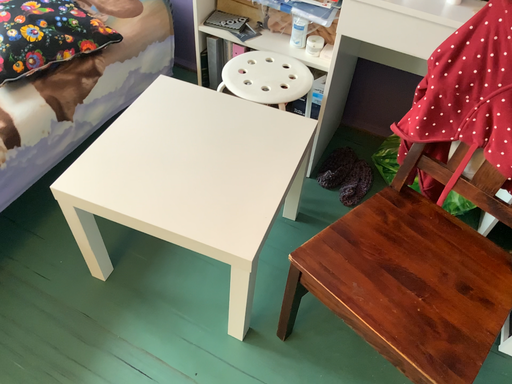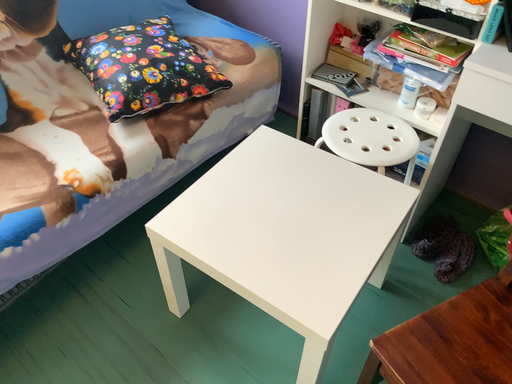
Question: How did the camera likely rotate when shooting the video?

Choices:
 (A) rotated right
 (B) rotated left

Answer: (B)